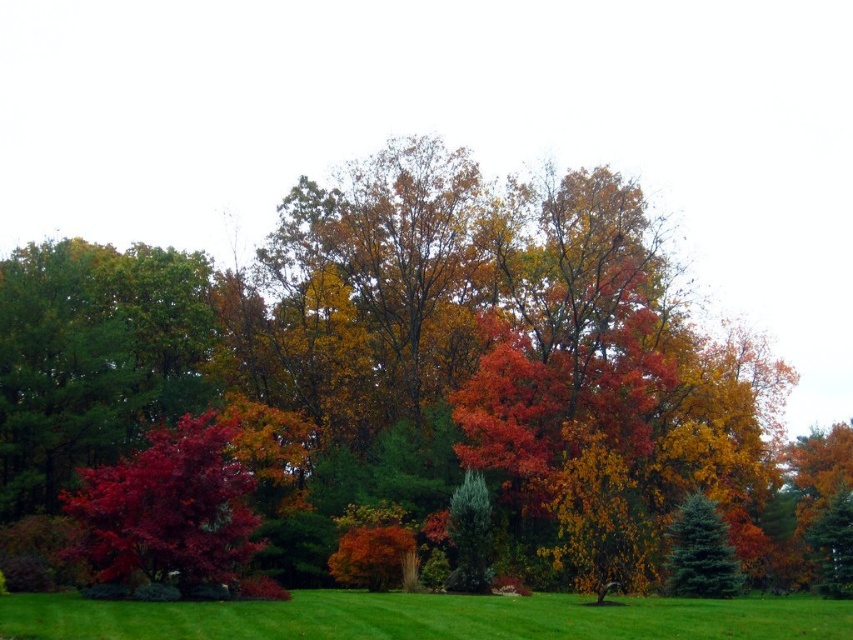
Who is more distant from viewer, (758, 566) or (693, 579)?

The point (758, 566) is more distant.

Is shiny red maple at center wider than blue-green fir tree at center-right?

Yes, shiny red maple at center is wider than blue-green fir tree at center-right.

Describe the element at coordinates (401, 360) in the screenshot. I see `shiny red maple at center` at that location.

This screenshot has height=640, width=853. Identify the location of shiny red maple at center. (401, 360).

Is glossy red tree at left shorter than blue-green fir tree at center-right?

No.

Is glossy red tree at left wider than blue-green fir tree at center-right?

Indeed, glossy red tree at left has a greater width compared to blue-green fir tree at center-right.

Is point (97, 525) positioned before point (695, 525)?

Yes, point (97, 525) is closer to viewer.

Locate an element on the screen. glossy red tree at left is located at coordinates (167, 508).

Which of these two, shiny red maple at center or glossy red tree at left, stands taller?

Standing taller between the two is shiny red maple at center.

Does shiny red maple at center have a smaller size compared to glossy red tree at left?

Incorrect, shiny red maple at center is not smaller in size than glossy red tree at left.

Where is `shiny red maple at center`? shiny red maple at center is located at coordinates (401, 360).